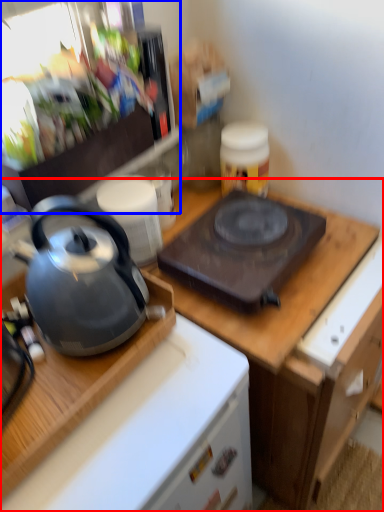
Question: Which object is further to the camera taking this photo, cabinetry (highlighted by a red box) or appliance (highlighted by a blue box)?

Choices:
 (A) cabinetry
 (B) appliance

Answer: (A)